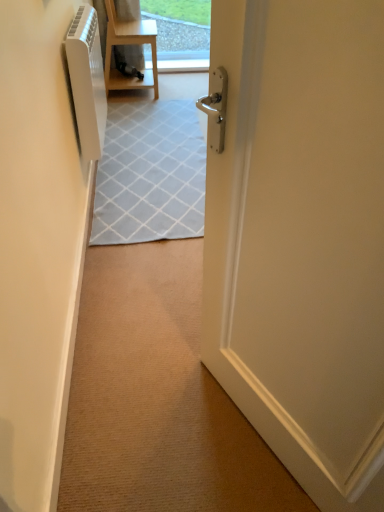
Question: In the image, is light wood/matte chair at upper center positioned in front of or behind white glossy door at center?

Choices:
 (A) behind
 (B) front

Answer: (A)

Question: Based on their sizes in the image, would you say light wood/matte chair at upper center is bigger or smaller than white glossy door at center?

Choices:
 (A) big
 (B) small

Answer: (B)

Question: Based on their relative distances, which object is farther from the white glossy radiator at left?

Choices:
 (A) white plastic air conditioner at left
 (B) white glossy door at center
 (C) light wood/matte chair at upper center

Answer: (C)

Question: Estimate the real-world distances between objects in this image. Which object is closer to the light wood/matte chair at upper center?

Choices:
 (A) white glossy radiator at left
 (B) white plastic air conditioner at left
 (C) white glossy door at center

Answer: (B)